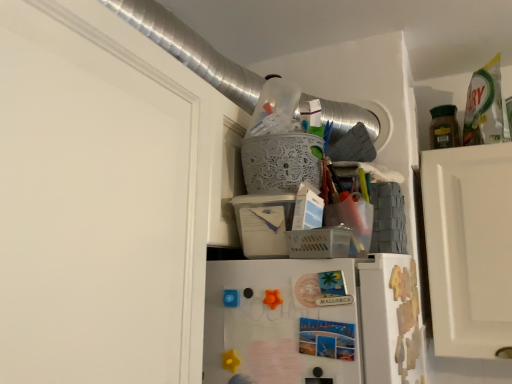
Question: Is white lace basket at upper center, acting as the second basket starting from the bottom, bigger than green matte jar at upper right?

Choices:
 (A) yes
 (B) no

Answer: (A)

Question: Does white lace basket at upper center, acting as the second basket starting from the bottom, have a smaller size compared to green matte jar at upper right?

Choices:
 (A) no
 (B) yes

Answer: (A)

Question: Considering the relative sizes of white lace basket at upper center, acting as the second basket starting from the bottom, and green matte jar at upper right in the image provided, is white lace basket at upper center, acting as the second basket starting from the bottom, wider than green matte jar at upper right?

Choices:
 (A) no
 (B) yes

Answer: (B)

Question: From a real-world perspective, does white lace basket at upper center, which appears as the 1th basket when viewed from the top, sit lower than green matte jar at upper right?

Choices:
 (A) yes
 (B) no

Answer: (A)

Question: Does white lace basket at upper center, acting as the second basket starting from the bottom, lie behind green matte jar at upper right?

Choices:
 (A) yes
 (B) no

Answer: (B)

Question: Is green matte jar at upper right taller or shorter than plastic/mesh basket at upper center, which is the first basket in bottom-to-top order?

Choices:
 (A) tall
 (B) short

Answer: (A)

Question: In the image, is green matte jar at upper right on the left side or the right side of plastic/mesh basket at upper center, which is the 2th basket from top to bottom?

Choices:
 (A) left
 (B) right

Answer: (B)

Question: From the image's perspective, is green matte jar at upper right positioned above or below plastic/mesh basket at upper center, which is the first basket in bottom-to-top order?

Choices:
 (A) above
 (B) below

Answer: (A)

Question: Is point (431, 132) positioned closer to the camera than point (335, 226)?

Choices:
 (A) closer
 (B) farther

Answer: (B)

Question: Considering their positions, is green matte jar at upper right located in front of or behind white lace basket at upper center, acting as the second basket starting from the bottom?

Choices:
 (A) behind
 (B) front

Answer: (A)

Question: Choose the correct answer: Is green matte jar at upper right inside white lace basket at upper center, which appears as the 1th basket when viewed from the top, or outside it?

Choices:
 (A) outside
 (B) inside

Answer: (A)

Question: Considering the positions of green matte jar at upper right and white lace basket at upper center, acting as the second basket starting from the bottom, in the image, is green matte jar at upper right taller or shorter than white lace basket at upper center, acting as the second basket starting from the bottom,?

Choices:
 (A) tall
 (B) short

Answer: (A)

Question: From a real-world perspective, is green matte jar at upper right above or below white lace basket at upper center, acting as the second basket starting from the bottom?

Choices:
 (A) above
 (B) below

Answer: (A)

Question: Is white lace basket at upper center, acting as the second basket starting from the bottom, inside the boundaries of plastic/mesh basket at upper center, which is the 2th basket from top to bottom, or outside?

Choices:
 (A) outside
 (B) inside

Answer: (A)

Question: In the image, is white lace basket at upper center, acting as the second basket starting from the bottom, positioned in front of or behind plastic/mesh basket at upper center, which is the first basket in bottom-to-top order?

Choices:
 (A) front
 (B) behind

Answer: (B)